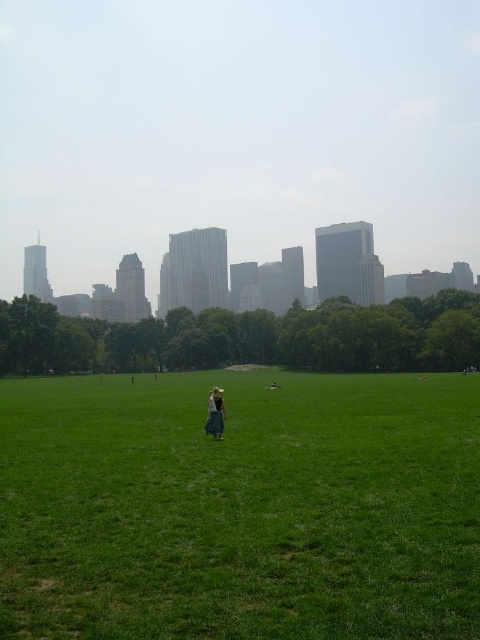
From the picture: You are a photographer standing at the edge of the green grass at center. You want to take a photo of the light brown fabric dress at center without any obstructions. Given that your camera has a maximum zoom range of 100 meters, can you capture the dress clearly from your current position?

The distance between the green grass at center and the light brown fabric dress at center is 19.20 meters, which is within the camera maximum zoom range of 100 meters. Therefore, you can capture the dress clearly from your current position.